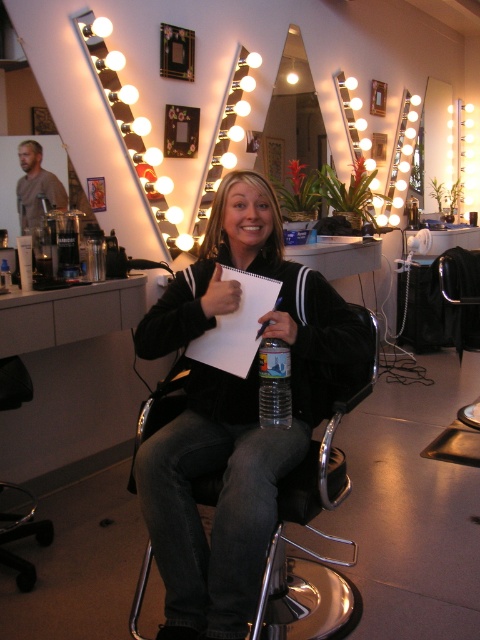
You are a stylist in the salon and need to place the black velvet jacket at center and the clear plastic bottle at center into a storage box. If the box can only hold one of them, which item should you choose based on their sizes?

The black velvet jacket at center has a larger size compared to the clear plastic bottle at center, so you should choose the black velvet jacket at center to place into the storage box since it requires more space.

You are a customer in the salon and want to sit down on the metallic silver swivel chair at lower left. However, there is a black velvet jacket at center in the way. Can you move the jacket to the side to access the chair?

The black velvet jacket at center is much taller than the metallic silver swivel chair at lower left, so it might be difficult to move it out of the way without assistance. You may need to ask someone to help you move the jacket.

You are a customer entering the salon and want to sit in the metallic silver swivel chair at lower left. Where should you place the black velvet jacket at center when you sit down?

The black velvet jacket at center is located above the metallic silver swivel chair at lower left, so you should place it on the chair before sitting down.